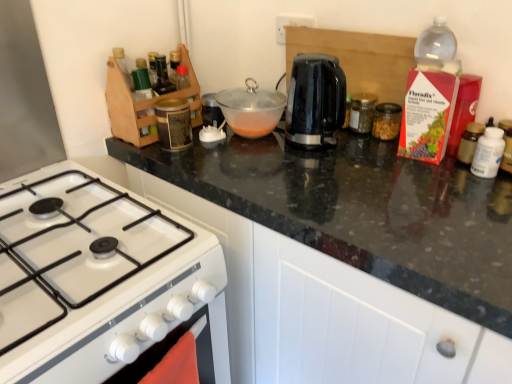
Image resolution: width=512 pixels, height=384 pixels. I want to click on vacant area situated to the left side of clear glass jar at center-right, the fourth kitchen appliance viewed from the left, so click(343, 145).